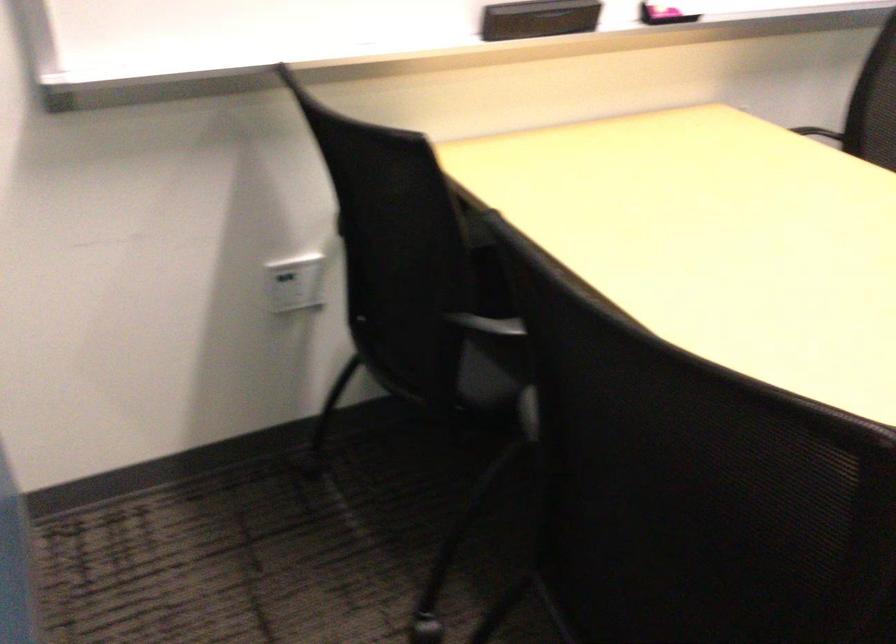
Image resolution: width=896 pixels, height=644 pixels. I want to click on white light switch, so click(x=295, y=283).